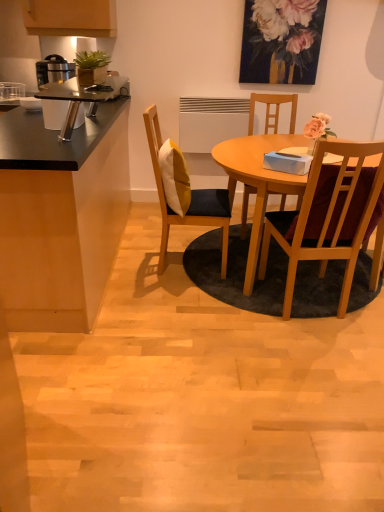
Image resolution: width=384 pixels, height=512 pixels. Identify the location of space that is in front of wooden chair with cushion at center, the 3th chair from the right. (168, 302).